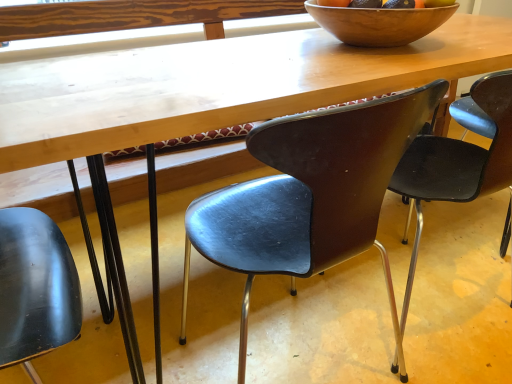
Question: Looking at their shapes, would you say matte black chair at center, arranged as the second chair when viewed from the left, is wider or thinner than matte brown chair at upper right, which is the third chair in left-to-right order?

Choices:
 (A) wide
 (B) thin

Answer: (A)

Question: In the image, is matte black chair at center, the second chair viewed from the right, on the left side or the right side of matte brown chair at upper right, which is the third chair in left-to-right order?

Choices:
 (A) left
 (B) right

Answer: (A)

Question: Estimate the real-world distances between objects in this image. Which object is closer to the wooden bowl at upper center?

Choices:
 (A) matte black chair at center, the second chair viewed from the right
 (B) matte brown chair at upper right, the first chair from the right
 (C) matte black chair at lower left, the 3th chair when ordered from right to left

Answer: (B)

Question: Estimate the real-world distances between objects in this image. Which object is closer to the matte brown chair at upper right, the first chair from the right?

Choices:
 (A) matte black chair at lower left, the 3th chair when ordered from right to left
 (B) matte black chair at center, arranged as the second chair when viewed from the left
 (C) wooden bowl at upper center

Answer: (B)